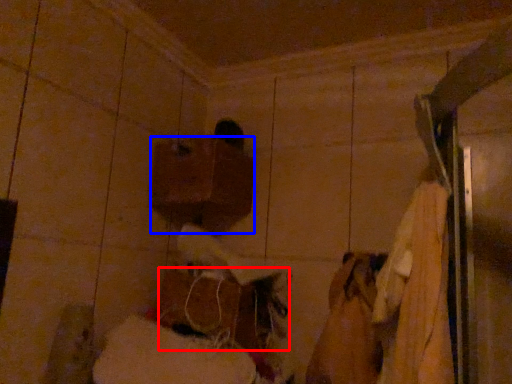
Question: Which point is closer to the camera, wood (highlighted by a red box) or wood (highlighted by a blue box)?

Choices:
 (A) wood
 (B) wood

Answer: (A)